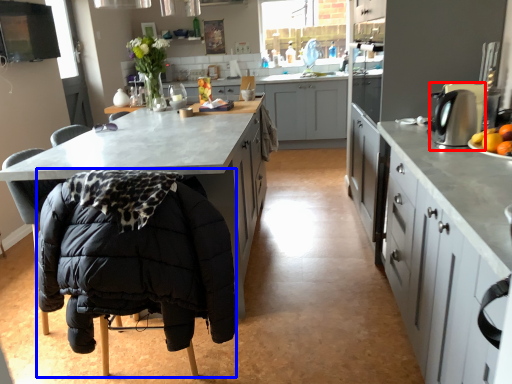
Question: Which of the following is the closest to the observer, kitchen appliance (highlighted by a red box) or folding chair (highlighted by a blue box)?

Choices:
 (A) kitchen appliance
 (B) folding chair

Answer: (B)